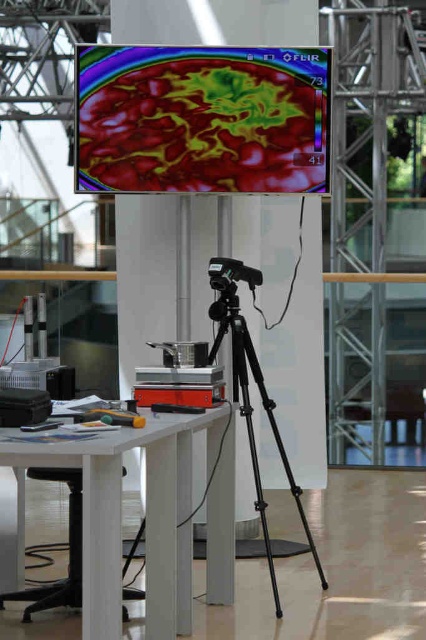
Is white matte table at lower left to the right of black plastic stool at lower left from the viewer's perspective?

Indeed, white matte table at lower left is positioned on the right side of black plastic stool at lower left.

Between white matte table at lower left and black plastic stool at lower left, which one is positioned higher?

white matte table at lower left is higher up.

The width and height of the screenshot is (426, 640). Describe the element at coordinates (147, 516) in the screenshot. I see `white matte table at lower left` at that location.

The width and height of the screenshot is (426, 640). What are the coordinates of `white matte table at lower left` in the screenshot? It's located at (147, 516).

Does black plastic stool at lower left lie in front of black plastic video camera at center?

Yes.

Can you confirm if black plastic stool at lower left is positioned to the right of black plastic video camera at center?

No, black plastic stool at lower left is not to the right of black plastic video camera at center.

This screenshot has height=640, width=426. What do you see at coordinates (68, 548) in the screenshot?
I see `black plastic stool at lower left` at bounding box center [68, 548].

At what (x,y) coordinates should I click in order to perform the action: click on black plastic stool at lower left. Please return your answer as a coordinate pair (x, y). Looking at the image, I should click on (68, 548).

Which is above, thermal imaging screen at center or white matte table at lower left?

thermal imaging screen at center

Describe the element at coordinates (201, 120) in the screenshot. I see `thermal imaging screen at center` at that location.

Is point (198, 102) more distant than point (164, 556)?

That is True.

You are a GUI agent. You are given a task and a screenshot of the screen. Output one action in this format:
    pyautogui.click(x=<x>, y=<y>)
    Task: Click on the thermal imaging screen at center
    
    Given the screenshot: What is the action you would take?
    pyautogui.click(x=201, y=120)